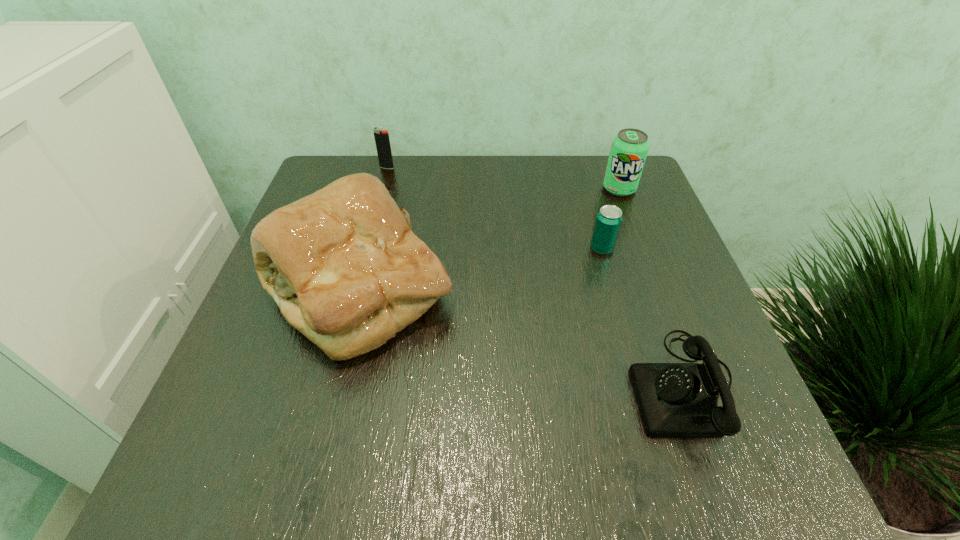
You are a GUI agent. You are given a task and a screenshot of the screen. Output one action in this format:
    pyautogui.click(x=<x>, y=<y>)
    Task: Click on the empty space that is in between the beer can and the tallest object
    
    Given the screenshot: What is the action you would take?
    pyautogui.click(x=480, y=269)

Image resolution: width=960 pixels, height=540 pixels. In order to click on object that is the fourth closest to the second tallest object in this screenshot , I will do `click(382, 141)`.

At what (x,y) coordinates should I click in order to perform the action: click on object that is the fourth closest to the pop soda. Please return your answer as a coordinate pair (x, y). Image resolution: width=960 pixels, height=540 pixels. Looking at the image, I should click on (382, 141).

In order to click on free space that satisfies the following two spatial constraints: 1. on the front-facing side of the fourth nearest object; 2. on the filling side of the bread in this screenshot , I will do `click(657, 289)`.